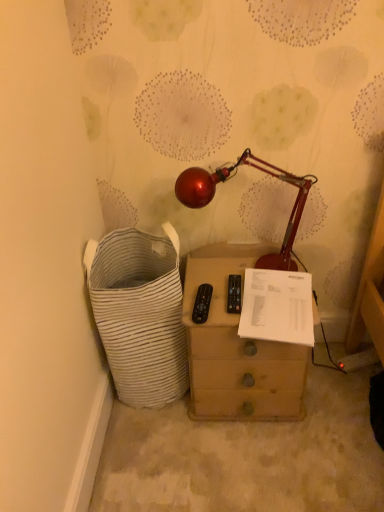
Identify the location of free spot above wooden chest of drawers at center (from a real-world perspective). This screenshot has width=384, height=512. (241, 289).